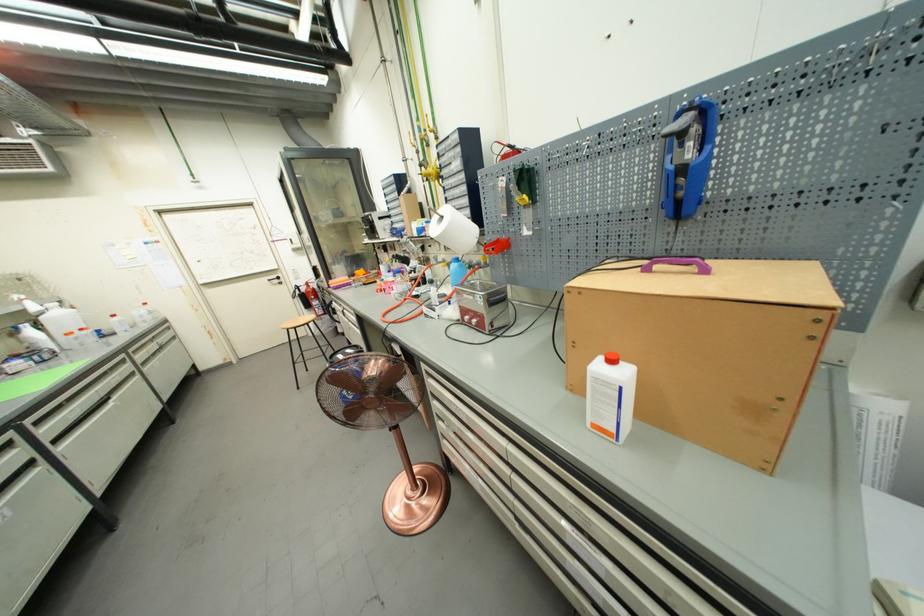
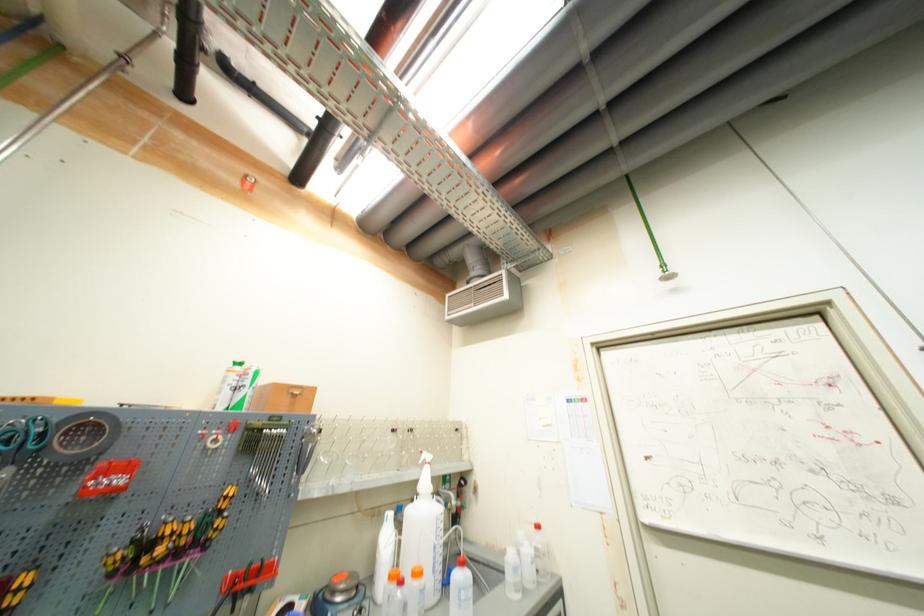
The point at (154, 320) is marked in the first image. Where is the corresponding point in the second image?

(533, 578)